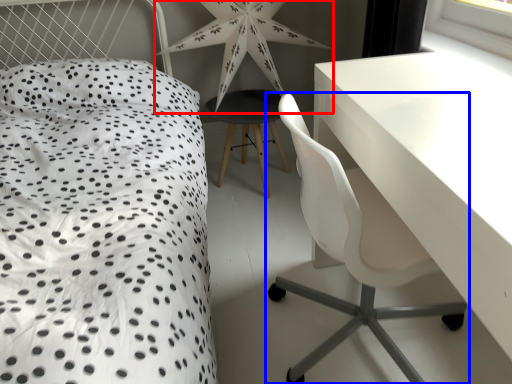
Question: Which object appears closest to the camera in this image, star (highlighted by a red box) or chair (highlighted by a blue box)?

Choices:
 (A) star
 (B) chair

Answer: (B)